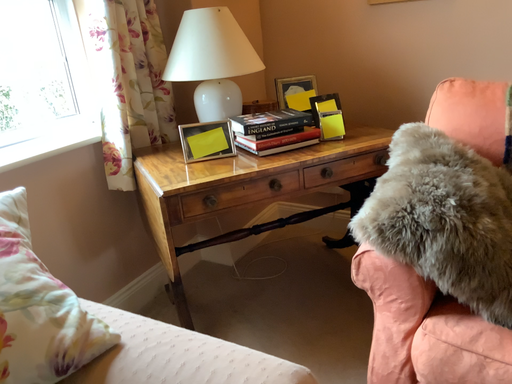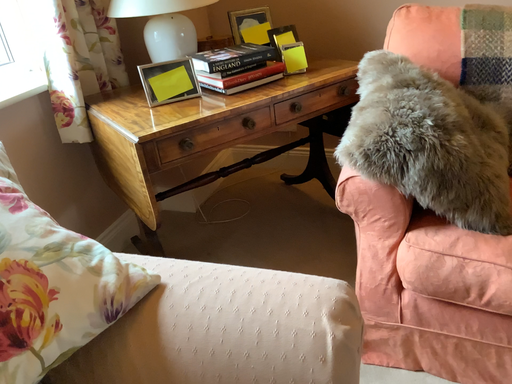
Question: How did the camera likely rotate when shooting the video?

Choices:
 (A) rotated right
 (B) rotated left

Answer: (A)